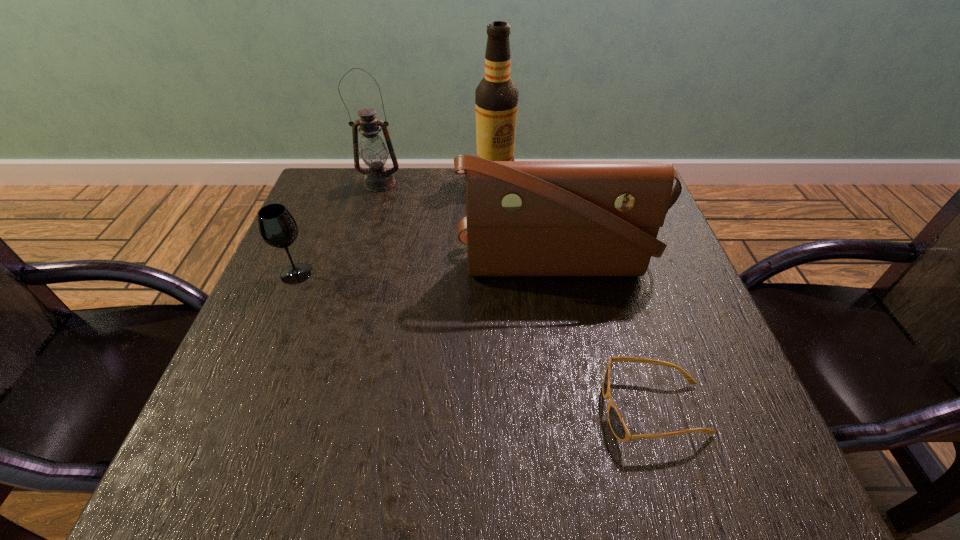
Where is `object that is the third closest to the tallest object`? This screenshot has width=960, height=540. object that is the third closest to the tallest object is located at coordinates (277, 227).

What are the coordinates of `free space that satisfies the following two spatial constraints: 1. on the back side of the oil lamp; 2. on the right side of the second shortest object` in the screenshot? It's located at (334, 183).